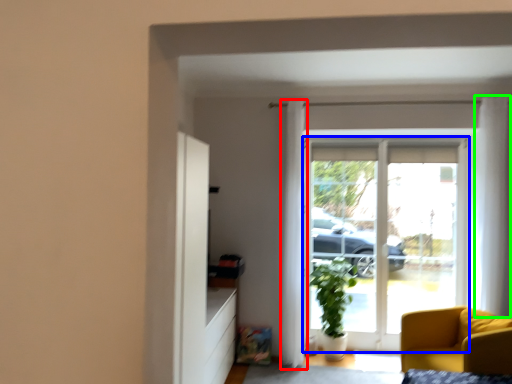
Question: Which is nearer to the curtain (highlighted by a red box)? door (highlighted by a blue box) or curtain (highlighted by a green box).

Choices:
 (A) door
 (B) curtain

Answer: (A)